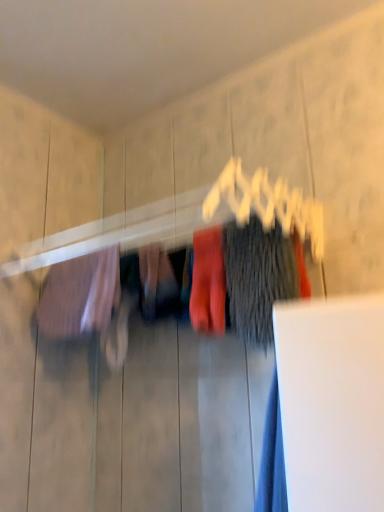
Question: Is matte pink fabric at left, which is the third clothing in right-to-left order, in front of or behind matte red socks at center, the 2th clothing in the left-to-right sequence, in the image?

Choices:
 (A) behind
 (B) front

Answer: (A)

Question: From a real-world perspective, is matte pink fabric at left, marked as the first clothing in a left-to-right arrangement, positioned above or below matte red socks at center, the 2th clothing in the left-to-right sequence?

Choices:
 (A) above
 (B) below

Answer: (A)

Question: Which object is positioned farthest from the matte red socks at center, the 2th clothing in the left-to-right sequence?

Choices:
 (A) matte pink fabric at left, which is the third clothing in right-to-left order
 (B) dark gray fuzzy sweater at center, acting as the 1th clothing starting from the right

Answer: (A)

Question: Which of these objects is positioned closest to the matte pink fabric at left, marked as the first clothing in a left-to-right arrangement?

Choices:
 (A) dark gray fuzzy sweater at center, placed as the 3th clothing when sorted from left to right
 (B) matte red socks at center, which is the 2th clothing from right to left

Answer: (B)